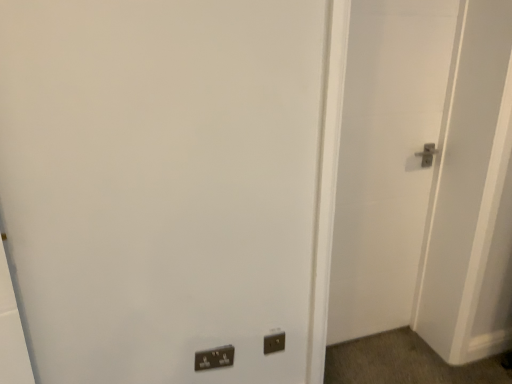
Question: Considering the relative positions of white matte door at right and black plastic electric outlet at lower center in the image provided, is white matte door at right to the right of black plastic electric outlet at lower center from the viewer's perspective?

Choices:
 (A) no
 (B) yes

Answer: (B)

Question: From the image's perspective, would you say white matte door at right is shown under black plastic electric outlet at lower center?

Choices:
 (A) yes
 (B) no

Answer: (B)

Question: Does white matte door at right come behind black plastic electric outlet at lower center?

Choices:
 (A) yes
 (B) no

Answer: (B)

Question: Is white matte door at right bigger than black plastic electric outlet at lower center?

Choices:
 (A) no
 (B) yes

Answer: (B)

Question: Is black plastic electric outlet at lower center inside white matte door at right?

Choices:
 (A) yes
 (B) no

Answer: (B)

Question: In the image, is black plastic electric outlet at lower center positioned in front of or behind matte black switch at lower center?

Choices:
 (A) front
 (B) behind

Answer: (B)

Question: From the image's perspective, relative to matte black switch at lower center, is black plastic electric outlet at lower center above or below?

Choices:
 (A) above
 (B) below

Answer: (A)

Question: Considering the positions of black plastic electric outlet at lower center and matte black switch at lower center in the image, is black plastic electric outlet at lower center wider or thinner than matte black switch at lower center?

Choices:
 (A) wide
 (B) thin

Answer: (B)

Question: Considering the positions of point (268, 344) and point (201, 360), is point (268, 344) closer or farther from the camera than point (201, 360)?

Choices:
 (A) farther
 (B) closer

Answer: (A)

Question: Based on their sizes in the image, would you say black plastic electric outlet at lower center is bigger or smaller than white matte door at right?

Choices:
 (A) small
 (B) big

Answer: (A)

Question: From a real-world perspective, relative to white matte door at right, is black plastic electric outlet at lower center vertically above or below?

Choices:
 (A) above
 (B) below

Answer: (B)

Question: From the image's perspective, is black plastic electric outlet at lower center located above or below white matte door at right?

Choices:
 (A) above
 (B) below

Answer: (B)

Question: Is black plastic electric outlet at lower center situated inside white matte door at right or outside?

Choices:
 (A) inside
 (B) outside

Answer: (B)

Question: In the image, is matte black switch at lower center on the left side or the right side of black plastic electric outlet at lower center?

Choices:
 (A) left
 (B) right

Answer: (A)

Question: Considering the positions of point (197, 352) and point (266, 344), is point (197, 352) closer or farther from the camera than point (266, 344)?

Choices:
 (A) closer
 (B) farther

Answer: (A)